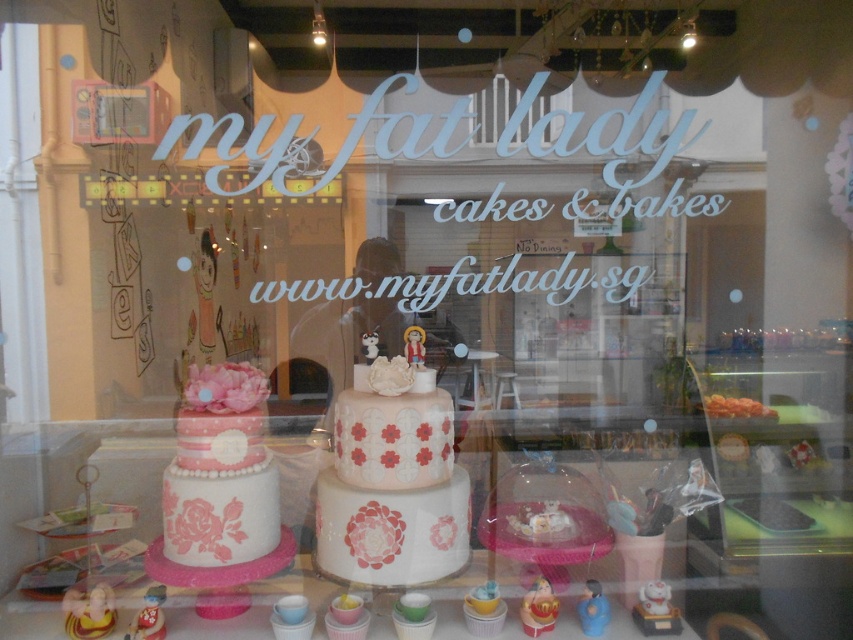
Based on the photo, you are standing outside the bakery looking through the storefront window. Where exactly is the pink matte cake at center located in the window display?

The pink matte cake at center is located at point (392,481) in the window display.

You are a customer looking at the bakery window display. You see the pink matte cake at center and the matte pink fondant cake at center. Which one is positioned higher in the display?

The pink matte cake at center is positioned higher than the matte pink fondant cake at center.